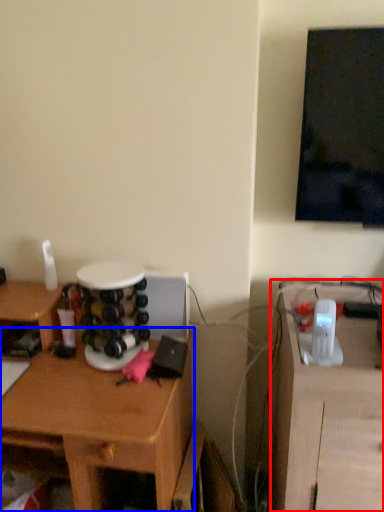
Question: Which of the following is the farthest to the observer, computer desk (highlighted by a red box) or desk (highlighted by a blue box)?

Choices:
 (A) computer desk
 (B) desk

Answer: (B)